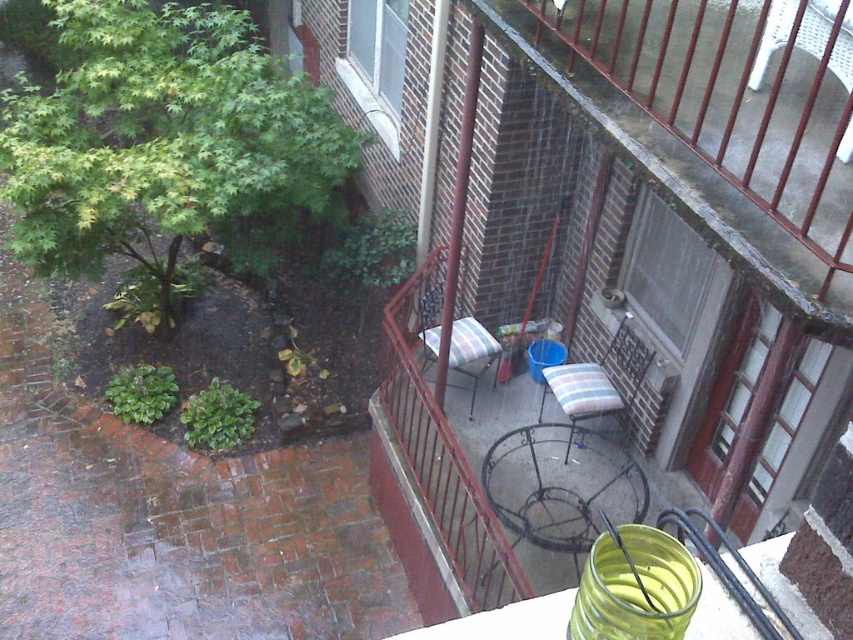
You are standing on the elevated patio and want to place a new potted plant between the two striped fabric chairs at center and the striped fabric chair at center. Is there enough space between them to fit the plant?

The distance between the striped fabric chairs at center and the striped fabric chair at center is 7.72 feet, so there is sufficient space to place a new potted plant between them.

In the scene shown: You are standing on the elevated position looking down at the patio. You want to place a 8 feet long wooden bench between the striped fabric chairs at center and yourself. Will the bench fit in the available space?

The distance between the striped fabric chairs at center and the viewer is 7.70 feet. Since the bench is 8 feet long, it will not fit in the available space as it is slightly longer than the distance.